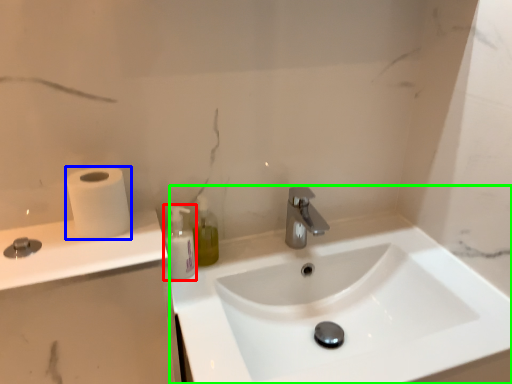
Question: Which object is positioned closest to mouthwash (highlighted by a red box)? Select from toilet paper (highlighted by a blue box) and sink (highlighted by a green box).

Choices:
 (A) toilet paper
 (B) sink

Answer: (A)